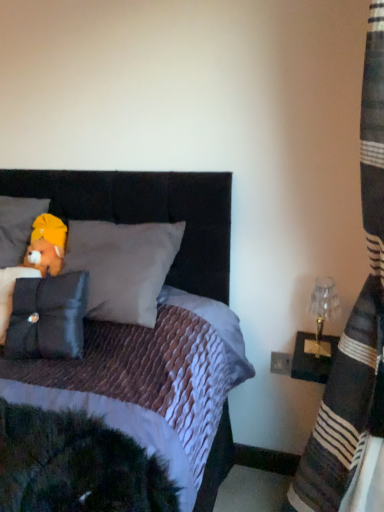
Question: Is soft gray pillow at upper left, placed as the 1th pillow when sorted from top to bottom, to the right of striped fabric curtain at right from the viewer's perspective?

Choices:
 (A) yes
 (B) no

Answer: (B)

Question: From a real-world perspective, is soft gray pillow at upper left, placed as the 1th pillow when sorted from top to bottom, physically above striped fabric curtain at right?

Choices:
 (A) no
 (B) yes

Answer: (B)

Question: Is striped fabric curtain at right a part of soft gray pillow at upper left, which is the 2th pillow from front to back?

Choices:
 (A) no
 (B) yes

Answer: (A)

Question: Can you confirm if soft gray pillow at upper left, placed as the 1th pillow when sorted from top to bottom, is positioned to the left of striped fabric curtain at right?

Choices:
 (A) yes
 (B) no

Answer: (A)

Question: Considering the relative positions of soft gray pillow at upper left, arranged as the 1th pillow when viewed from the back, and striped fabric curtain at right in the image provided, is soft gray pillow at upper left, arranged as the 1th pillow when viewed from the back, in front of striped fabric curtain at right?

Choices:
 (A) no
 (B) yes

Answer: (A)

Question: Relative to clear glass lampshade at right, is velvet black headboard at upper center in front or behind?

Choices:
 (A) behind
 (B) front

Answer: (B)

Question: Does point (9, 175) appear closer or farther from the camera than point (332, 312)?

Choices:
 (A) closer
 (B) farther

Answer: (B)

Question: Considering the positions of velvet black headboard at upper center and clear glass lampshade at right in the image, is velvet black headboard at upper center wider or thinner than clear glass lampshade at right?

Choices:
 (A) wide
 (B) thin

Answer: (A)

Question: Is velvet black headboard at upper center spatially inside clear glass lampshade at right, or outside of it?

Choices:
 (A) inside
 (B) outside

Answer: (B)

Question: In terms of width, does striped fabric curtain at right look wider or thinner when compared to black velvet pillow at left, which is the 2th pillow from back to front?

Choices:
 (A) wide
 (B) thin

Answer: (A)

Question: From their relative heights in the image, would you say striped fabric curtain at right is taller or shorter than black velvet pillow at left, which is the 2th pillow from back to front?

Choices:
 (A) short
 (B) tall

Answer: (B)

Question: From a real-world perspective, relative to black velvet pillow at left, the first pillow viewed from the front, is striped fabric curtain at right vertically above or below?

Choices:
 (A) below
 (B) above

Answer: (B)

Question: Is striped fabric curtain at right to the left or to the right of black velvet pillow at left, which appears as the 1th pillow when ordered from the bottom, in the image?

Choices:
 (A) right
 (B) left

Answer: (A)

Question: Considering the positions of striped fabric curtain at right and brown plush bear at upper left in the image, is striped fabric curtain at right wider or thinner than brown plush bear at upper left?

Choices:
 (A) wide
 (B) thin

Answer: (A)

Question: Would you say striped fabric curtain at right is to the left or to the right of brown plush bear at upper left in the picture?

Choices:
 (A) right
 (B) left

Answer: (A)